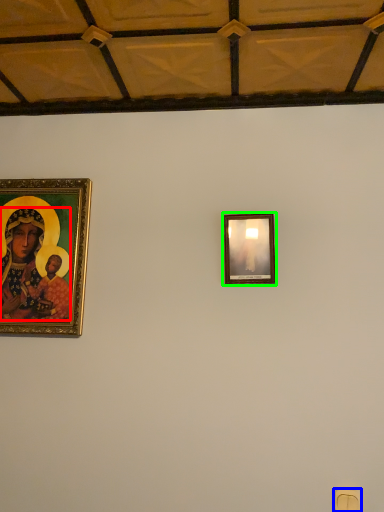
Question: Considering the real-world distances, which object is closest to person (highlighted by a red box)? light switch (highlighted by a blue box) or picture frame (highlighted by a green box).

Choices:
 (A) light switch
 (B) picture frame

Answer: (B)